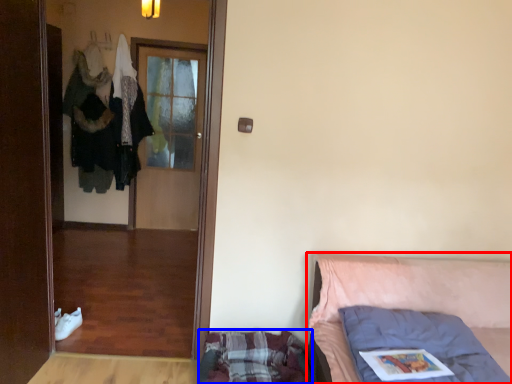
Question: Which object is further to the camera taking this photo, furniture (highlighted by a red box) or mattress (highlighted by a blue box)?

Choices:
 (A) furniture
 (B) mattress

Answer: (B)